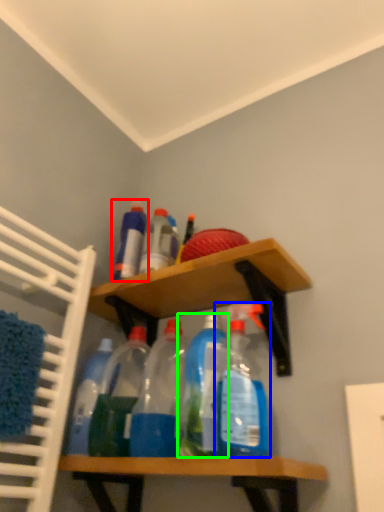
Question: Considering the real-world distances, which object is closest to bottle (highlighted by a red box)? bottle (highlighted by a blue box) or bottle (highlighted by a green box).

Choices:
 (A) bottle
 (B) bottle

Answer: (B)